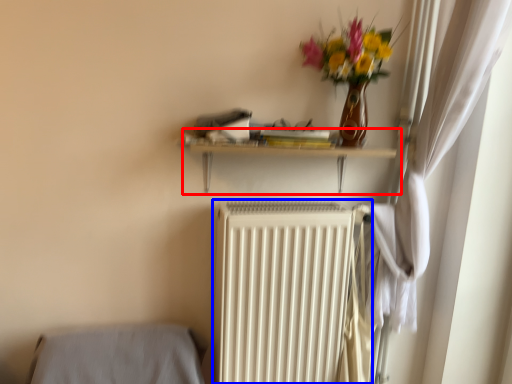
Question: Which of the following is the farthest to the observer, shelf (highlighted by a red box) or radiator (highlighted by a blue box)?

Choices:
 (A) shelf
 (B) radiator

Answer: (B)